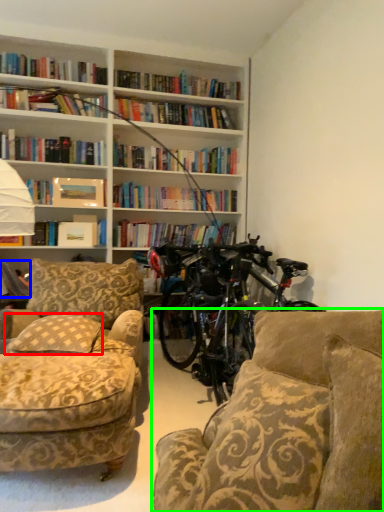
Question: Based on their relative distances, which object is nearer to pillow (highlighted by a red box)? Choose from book (highlighted by a blue box) and studio couch (highlighted by a green box).

Choices:
 (A) book
 (B) studio couch

Answer: (A)